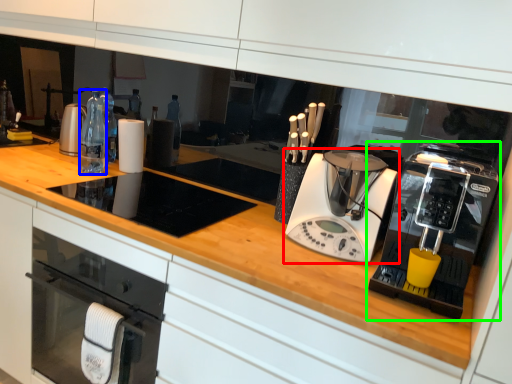
Question: Which is farther away from home appliance (highlighted by a red box)? bottle (highlighted by a blue box) or home appliance (highlighted by a green box)?

Choices:
 (A) bottle
 (B) home appliance

Answer: (A)